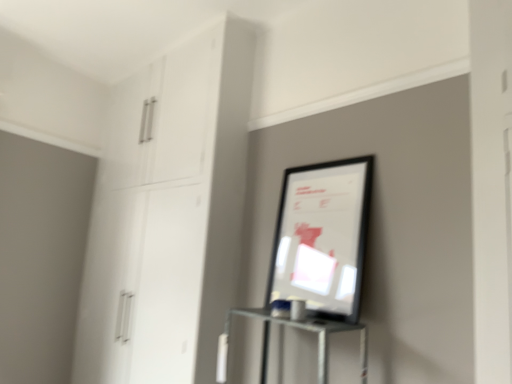
Image resolution: width=512 pixels, height=384 pixels. What do you see at coordinates (322, 237) in the screenshot? I see `matte black picture frame at center` at bounding box center [322, 237].

Identify the location of matte black picture frame at center. (322, 237).

The height and width of the screenshot is (384, 512). What do you see at coordinates (168, 215) in the screenshot?
I see `white glossy cabinet at upper left` at bounding box center [168, 215].

What are the coordinates of `white glossy cabinet at upper left` in the screenshot? It's located at (168, 215).

This screenshot has height=384, width=512. What are the coordinates of `matte black picture frame at center` in the screenshot? It's located at (322, 237).

Which is more to the right, matte black picture frame at center or white glossy cabinet at upper left?

Positioned to the right is matte black picture frame at center.

Is matte black picture frame at center positioned in front of white glossy cabinet at upper left?

Yes, the depth of matte black picture frame at center is less than that of white glossy cabinet at upper left.

Does point (325, 273) come farther from viewer compared to point (234, 177)?

No, (325, 273) is in front of (234, 177).

From the image's perspective, is matte black picture frame at center over white glossy cabinet at upper left?

Yes, from the image's perspective, matte black picture frame at center is on top of white glossy cabinet at upper left.

From a real-world perspective, which object stands above the other?

white glossy cabinet at upper left, from a real-world perspective.

Can you confirm if matte black picture frame at center is wider than white glossy cabinet at upper left?

No.

Does matte black picture frame at center have a greater height compared to white glossy cabinet at upper left?

Incorrect, the height of matte black picture frame at center is not larger of that of white glossy cabinet at upper left.

Considering the sizes of matte black picture frame at center and white glossy cabinet at upper left in the image, is matte black picture frame at center bigger or smaller than white glossy cabinet at upper left?

Considering their sizes, matte black picture frame at center takes up less space than white glossy cabinet at upper left.

Is matte black picture frame at center surrounding white glossy cabinet at upper left?

No, white glossy cabinet at upper left is not inside matte black picture frame at center.

In the scene shown: Is matte black picture frame at center not near white glossy cabinet at upper left?

Actually, matte black picture frame at center and white glossy cabinet at upper left are a little close together.

Is matte black picture frame at center oriented away from white glossy cabinet at upper left?

No, matte black picture frame at center's orientation is not away from white glossy cabinet at upper left.

How different are the orientations of matte black picture frame at center and white glossy cabinet at upper left in degrees?

The angular difference between matte black picture frame at center and white glossy cabinet at upper left is 0.548 degrees.

At what (x,y) coordinates should I click in order to perform the action: click on picture frame located in front of the white glossy cabinet at upper left. Please return your answer as a coordinate pair (x, y). Looking at the image, I should click on (322, 237).

Does white glossy cabinet at upper left appear on the right side of matte black picture frame at center?

Incorrect, white glossy cabinet at upper left is not on the right side of matte black picture frame at center.

Is white glossy cabinet at upper left positioned before matte black picture frame at center?

No.

Is point (180, 208) behind point (283, 207)?

That is True.

From the image's perspective, is white glossy cabinet at upper left under matte black picture frame at center?

Indeed, from the image's perspective, white glossy cabinet at upper left is shown beneath matte black picture frame at center.

From a real-world perspective, is white glossy cabinet at upper left located beneath matte black picture frame at center?

No.

Looking at this image, considering the sizes of objects white glossy cabinet at upper left and matte black picture frame at center in the image provided, who is thinner, white glossy cabinet at upper left or matte black picture frame at center?

Thinner between the two is matte black picture frame at center.

Does white glossy cabinet at upper left have a greater height compared to matte black picture frame at center?

Correct, white glossy cabinet at upper left is much taller as matte black picture frame at center.

Does white glossy cabinet at upper left have a smaller size compared to matte black picture frame at center?

Incorrect, white glossy cabinet at upper left is not smaller in size than matte black picture frame at center.

Is white glossy cabinet at upper left located outside matte black picture frame at center?

Indeed, white glossy cabinet at upper left is completely outside matte black picture frame at center.

Is there a large distance between white glossy cabinet at upper left and matte black picture frame at center?

No, white glossy cabinet at upper left is not far from matte black picture frame at center.

Is white glossy cabinet at upper left positioned with its back to matte black picture frame at center?

No, white glossy cabinet at upper left's orientation is not away from matte black picture frame at center.

How much distance is there between white glossy cabinet at upper left and matte black picture frame at center?

white glossy cabinet at upper left and matte black picture frame at center are 33.26 inches apart from each other.

Where is `picture frame that is in front of the white glossy cabinet at upper left`? picture frame that is in front of the white glossy cabinet at upper left is located at coordinates (322, 237).

Where is `dresser lying behind the matte black picture frame at center`? The image size is (512, 384). dresser lying behind the matte black picture frame at center is located at coordinates (168, 215).

Find the location of a particular element. The image size is (512, 384). dresser below the matte black picture frame at center (from the image's perspective) is located at coordinates (168, 215).